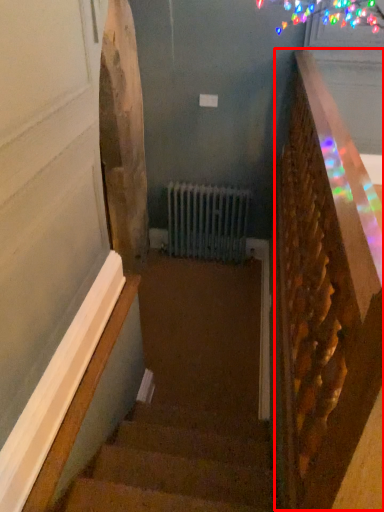
Question: From the image's perspective, what is the correct spatial positioning of rail (annotated by the red box) in reference to stairs?

Choices:
 (A) below
 (B) above

Answer: (B)